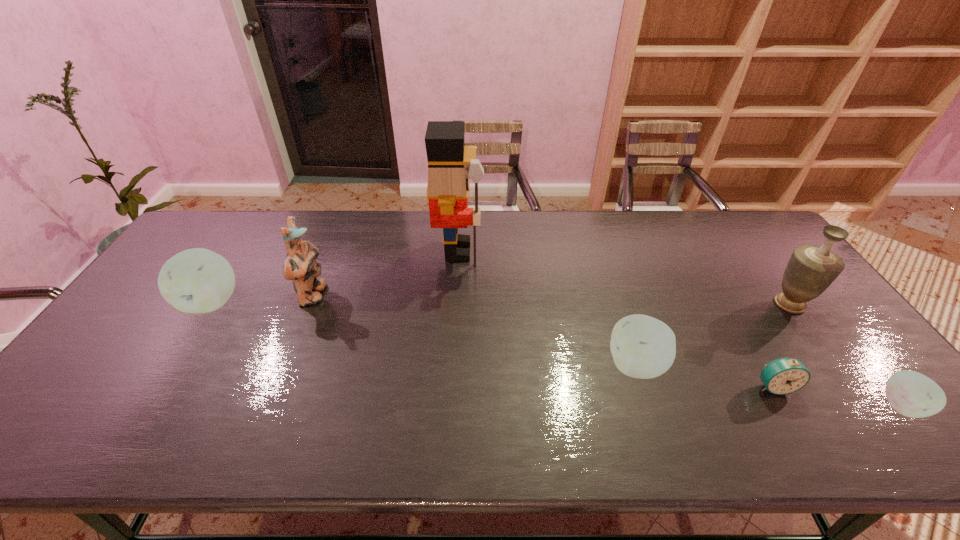
The width and height of the screenshot is (960, 540). Find the location of `the leftmost apple`. the leftmost apple is located at coordinates (198, 280).

Locate an element on the screen. Image resolution: width=960 pixels, height=540 pixels. the leftmost object is located at coordinates (198, 280).

Find the location of a particular element. The image size is (960, 540). the second tallest apple is located at coordinates pyautogui.click(x=644, y=347).

Find the location of `the fifth tallest object`. the fifth tallest object is located at coordinates (644, 347).

Image resolution: width=960 pixels, height=540 pixels. Find the location of `the rightmost apple`. the rightmost apple is located at coordinates (912, 394).

Locate an element on the screen. the tallest object is located at coordinates (448, 186).

Locate an element on the screen. This screenshot has height=540, width=960. the third object from left to right is located at coordinates (448, 186).

I want to click on urn, so click(x=811, y=269).

Find the location of `the sixth object from right to left`. the sixth object from right to left is located at coordinates (300, 266).

Identify the location of alarm clock. (782, 376).